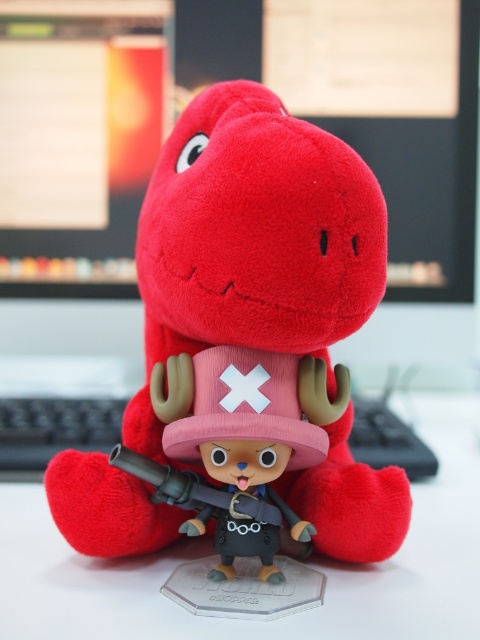
You need to place a rectangular box that is 10 cm thick on the desk. The box must be placed between the velvet plush dinosaur at center and the edge of the white glossy computer desk at center. Based on their thickness, will there be enough space for the box?

The velvet plush dinosaur at center is thinner than the white glossy computer desk at center. Since the box requires 10 cm of thickness, and the plush dinosaur is thinner than the desk, there should be sufficient space between them to place the box as long as the remaining space after accounting for the dinosaur is at least 10 cm. However, without exact measurements, we can infer that since the desk is thicker, there is likely enough room.

You are organizing a desk and need to ensure that the velvet plush dinosaur at center can fit on the white glossy computer desk at center. Based on their sizes, will the plush dinosaur fit on the desk?

The velvet plush dinosaur at center is smaller than the white glossy computer desk at center, so it will fit on the desk.